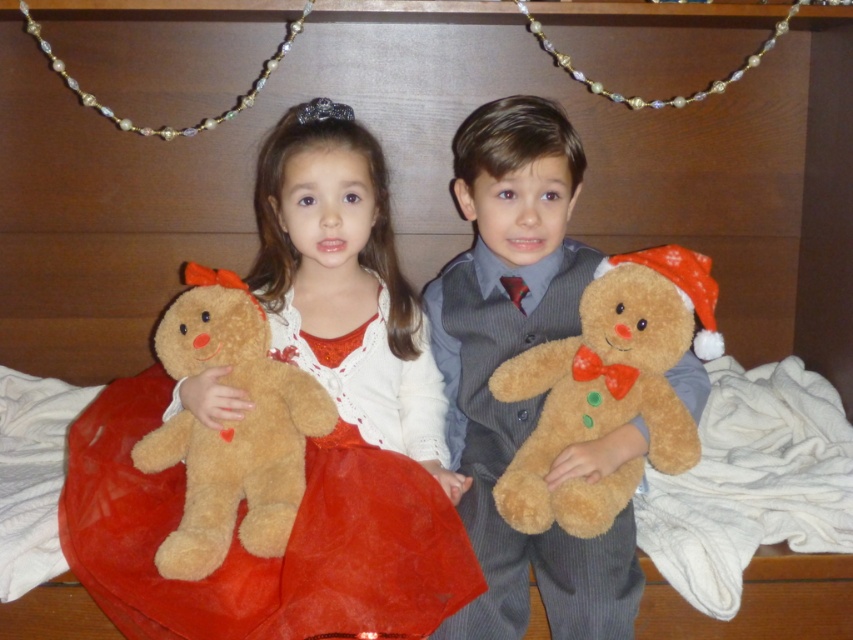
You are a photographer setting up for a family photo. You see the fuzzy brown teddy bear at center and the velvety red dress at center in the scene. Which object is closer to the camera?

The fuzzy brown teddy bear at center is closer to the camera because the velvety red dress at center is behind it.

You are a photographer trying to capture a closeup shot of the velvety red dress at center and the fuzzy brown teddy bear at left. Your camera can only focus on objects within a 3.5 inch range. Can you get both subjects in focus at the same time?

The velvety red dress at center is 4.05 inches away from the fuzzy brown teddy bear at left. Since the distance between them exceeds the camera focus range of 3.5 inches, you cannot get both subjects in focus simultaneously.